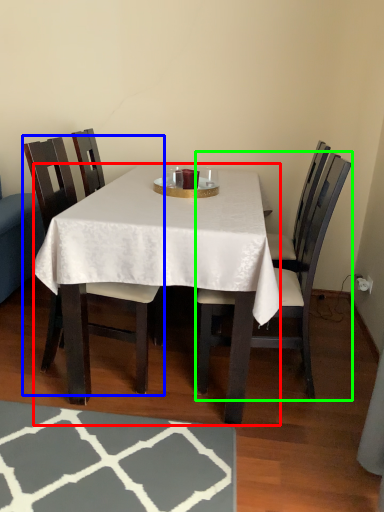
Question: Based on their relative distances, which object is nearer to desk (highlighted by a red box)? Choose from chair (highlighted by a blue box) and chair (highlighted by a green box).

Choices:
 (A) chair
 (B) chair

Answer: (B)